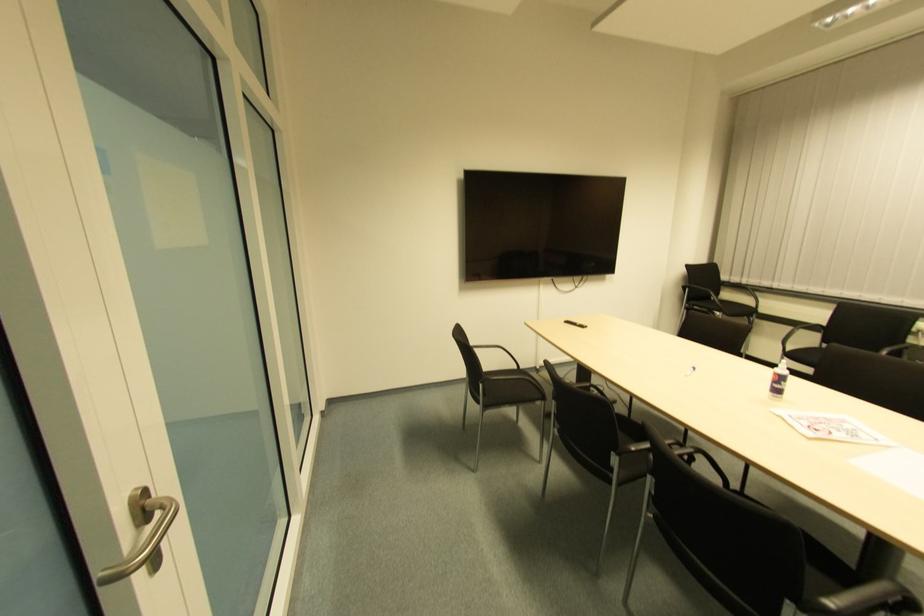
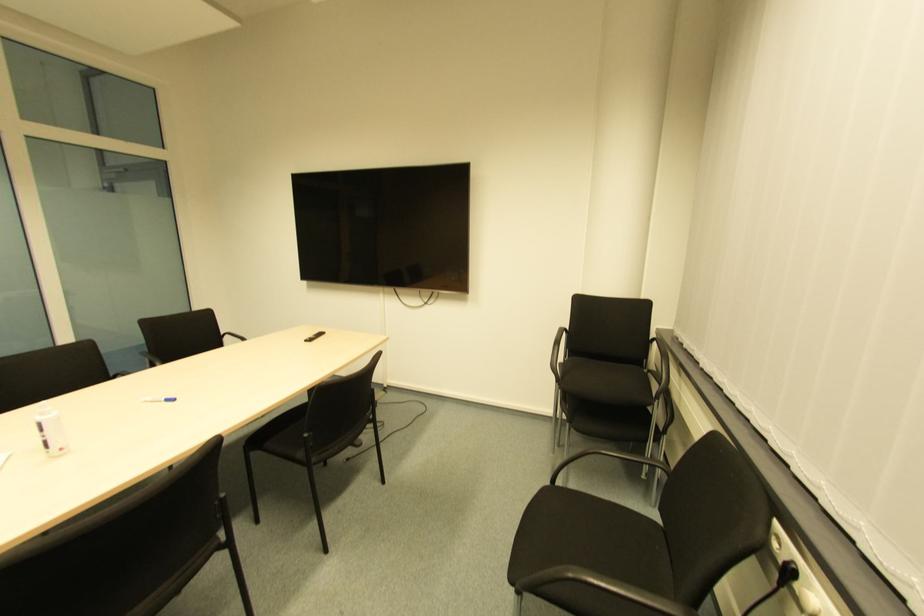
Find the pixel in the second image that matches pixel 691 371 in the first image.

(172, 403)